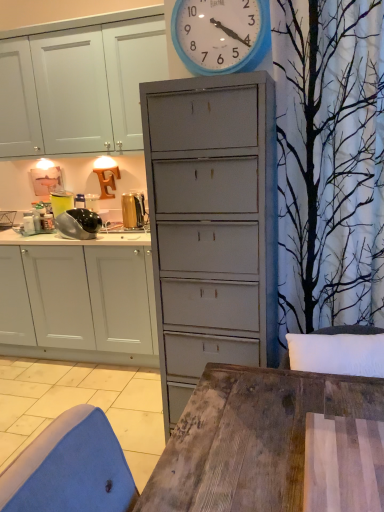
The height and width of the screenshot is (512, 384). In order to click on free location in front of gold metallic toaster at upper left, which is counted as the first appliance, starting from the right in this screenshot , I will do `click(123, 237)`.